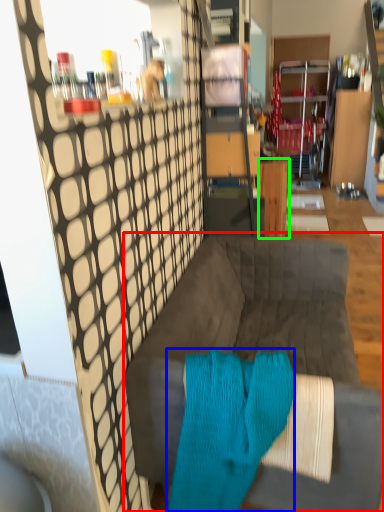
Question: Considering the real-world distances, which object is farthest from studio couch (highlighted by a red box)? aqua (highlighted by a blue box) or table (highlighted by a green box)?

Choices:
 (A) aqua
 (B) table

Answer: (B)